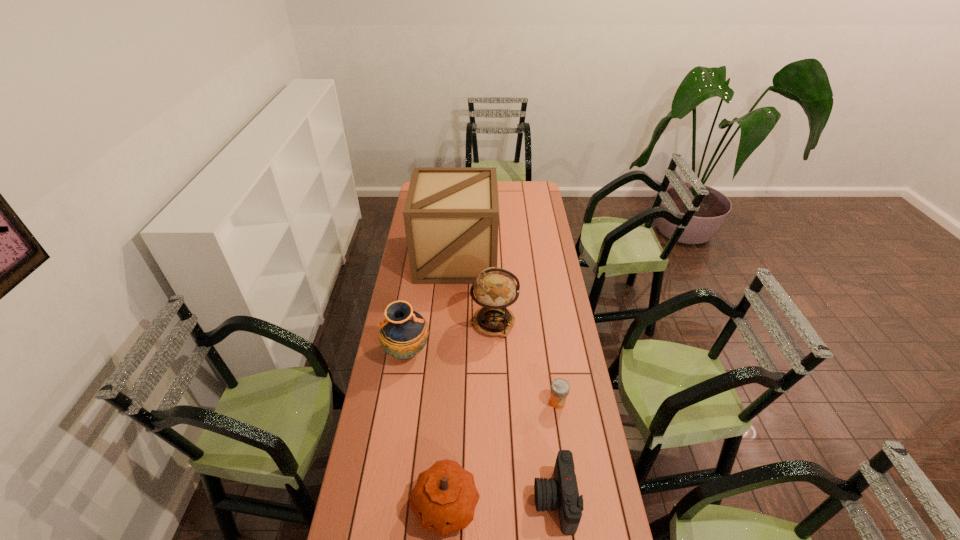
Locate an element on the screen. Image resolution: width=960 pixels, height=540 pixels. the farthest object is located at coordinates (451, 214).

You are a GUI agent. You are given a task and a screenshot of the screen. Output one action in this format:
    pyautogui.click(x=<x>, y=<y>)
    Task: Click on the box
    The height and width of the screenshot is (540, 960).
    Given the screenshot: What is the action you would take?
    pyautogui.click(x=451, y=214)

This screenshot has height=540, width=960. Identify the location of globe. (494, 288).

Locate an element on the screen. The image size is (960, 540). the third tallest object is located at coordinates (403, 334).

Locate an element on the screen. camera is located at coordinates (560, 493).

The height and width of the screenshot is (540, 960). I want to click on the shortest object, so click(x=560, y=388).

Find the location of a particular element. The width and height of the screenshot is (960, 540). medicine is located at coordinates (560, 388).

What are the coordinates of `vacant space located on the reinforced sides of the box` in the screenshot? It's located at (451, 325).

This screenshot has height=540, width=960. I want to click on vacant space located at the center of the globe, so click(x=458, y=323).

Identify the location of vacant space located 0.290m at the center of the globe. (403, 323).